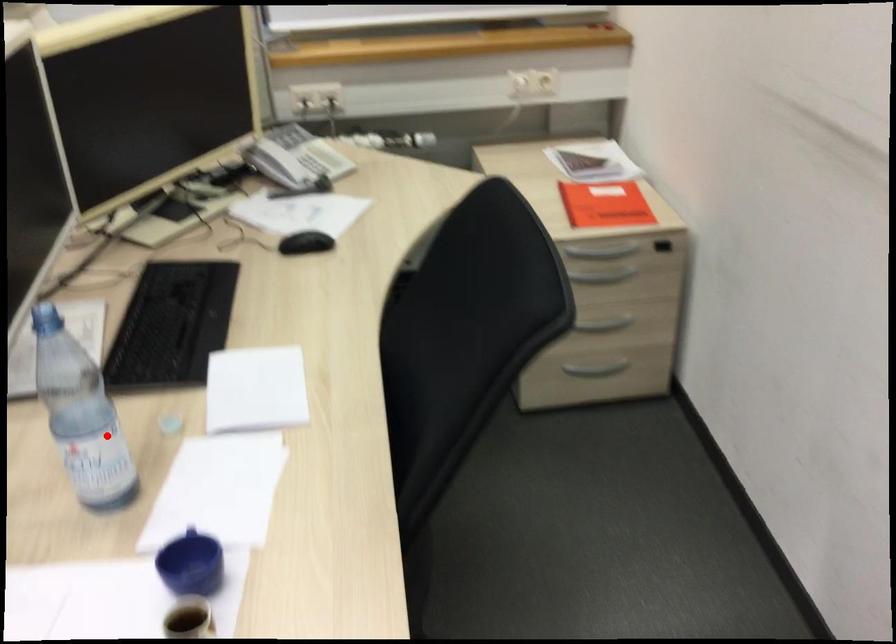
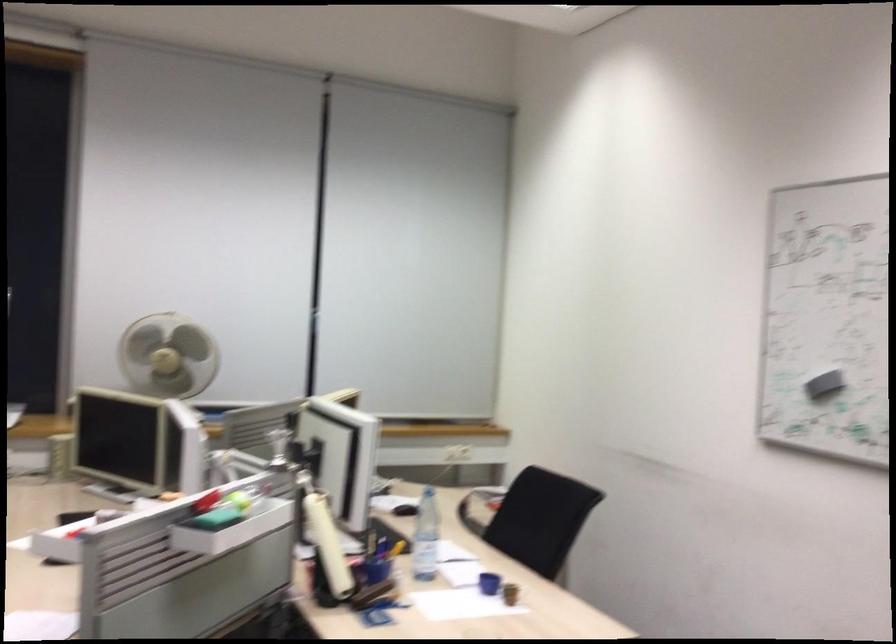
Locate, in the second image, the point that corresponds to the highlighted location in the first image.

(426, 536)